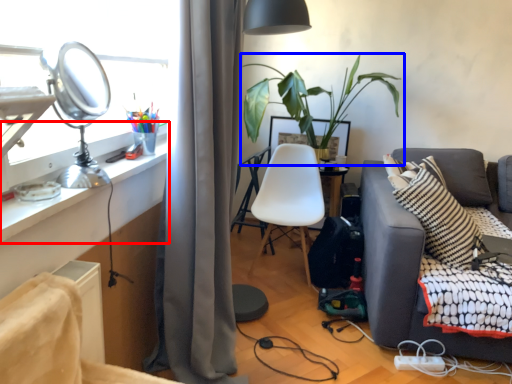
Question: Among these objects, which one is farthest to the camera, desk (highlighted by a red box) or houseplant (highlighted by a blue box)?

Choices:
 (A) desk
 (B) houseplant

Answer: (B)